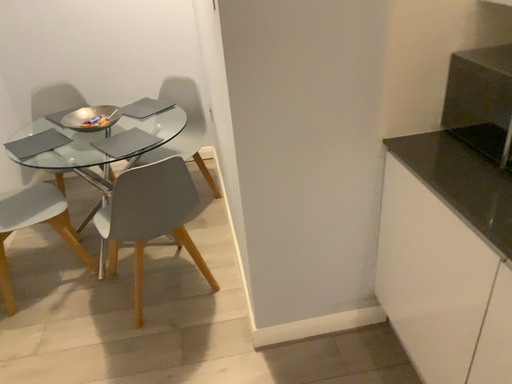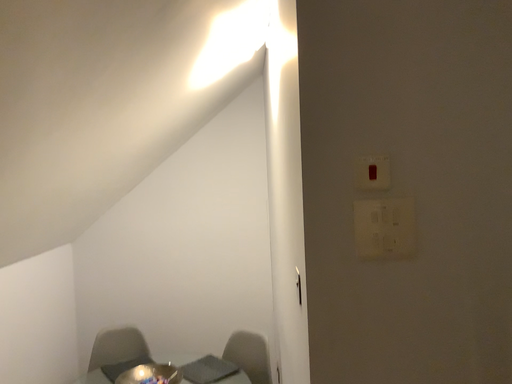
Question: How did the camera likely rotate when shooting the video?

Choices:
 (A) rotated upward
 (B) rotated downward

Answer: (A)